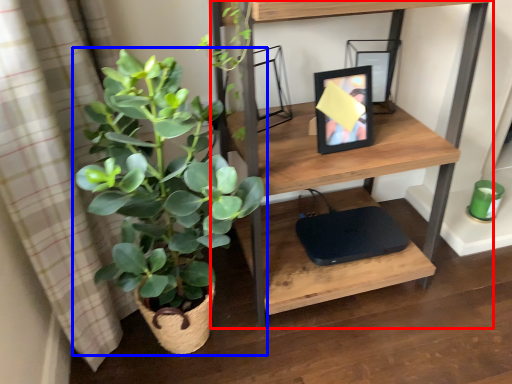
Question: Which object is closer to the camera taking this photo, shelf (highlighted by a red box) or houseplant (highlighted by a blue box)?

Choices:
 (A) shelf
 (B) houseplant

Answer: (B)